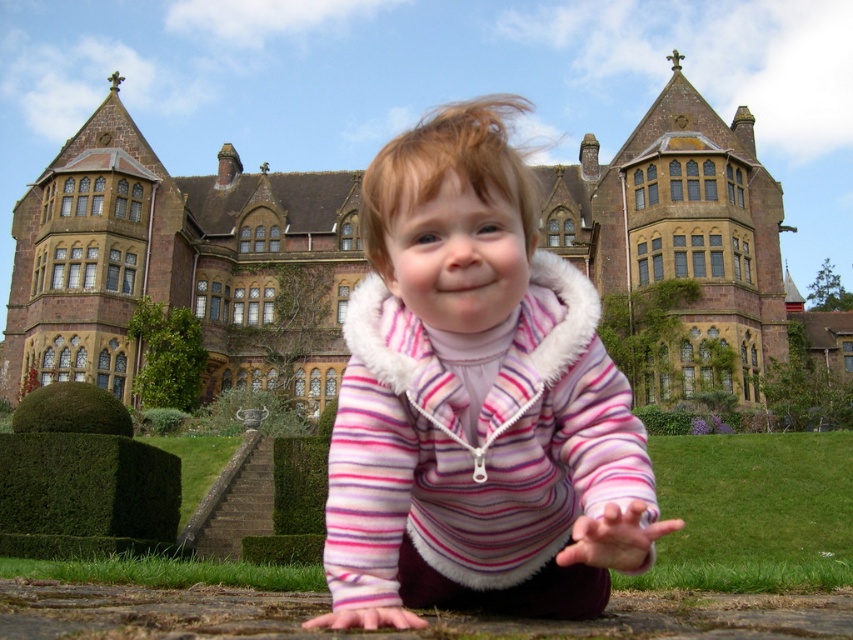
Question: Can you confirm if pink striped fleece at center is bigger than brown stone mansion at center?

Choices:
 (A) no
 (B) yes

Answer: (A)

Question: Observing the image, what is the correct spatial positioning of pink striped fleece at center in reference to brown stone mansion at center?

Choices:
 (A) below
 (B) above

Answer: (A)

Question: Can you confirm if pink striped fleece at center is positioned to the left of brown stone mansion at center?

Choices:
 (A) no
 (B) yes

Answer: (B)

Question: Which point is closer to the camera?

Choices:
 (A) brown stone mansion at center
 (B) pink striped fleece at center

Answer: (B)

Question: Which point is closer to the camera taking this photo?

Choices:
 (A) (724, 173)
 (B) (415, 189)

Answer: (B)